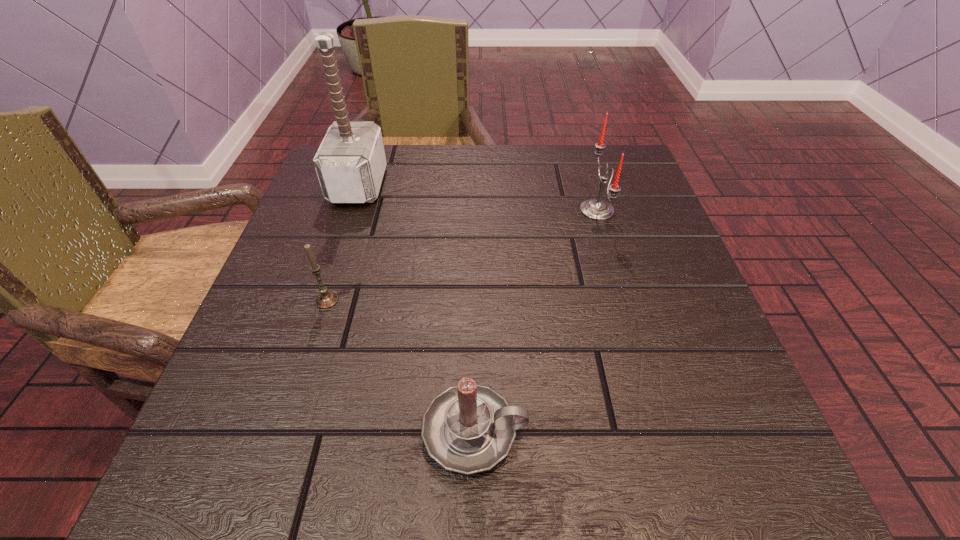
Locate an element on the screen. The height and width of the screenshot is (540, 960). the tallest object is located at coordinates (350, 163).

What are the coordinates of `the rightmost candle` in the screenshot? It's located at (596, 209).

This screenshot has width=960, height=540. Find the location of `the tallest candle`. the tallest candle is located at coordinates click(596, 209).

Find the location of a particular element. the second nearest object is located at coordinates (326, 299).

You are a GUI agent. You are given a task and a screenshot of the screen. Output one action in this format:
    pyautogui.click(x=<x>, y=<y>)
    Task: Click on the leftmost candle
    Image resolution: width=960 pixels, height=540 pixels.
    Given the screenshot: What is the action you would take?
    pyautogui.click(x=326, y=299)

The width and height of the screenshot is (960, 540). What are the coordinates of `the second object from right to left` in the screenshot? It's located at (469, 428).

Where is `the nearest object`? The image size is (960, 540). the nearest object is located at coordinates (469, 428).

The image size is (960, 540). Identify the location of vacant space situated 0.350m for striking with the head of the tallest object. (541, 185).

The width and height of the screenshot is (960, 540). Find the location of `blank space located 0.150m on the front-facing side of the rightmost candle`. blank space located 0.150m on the front-facing side of the rightmost candle is located at coordinates (508, 210).

At what (x,y) coordinates should I click in order to perform the action: click on free point located on the front-facing side of the rightmost candle. Please return your answer as a coordinate pair (x, y). This screenshot has height=540, width=960. Looking at the image, I should click on (541, 210).